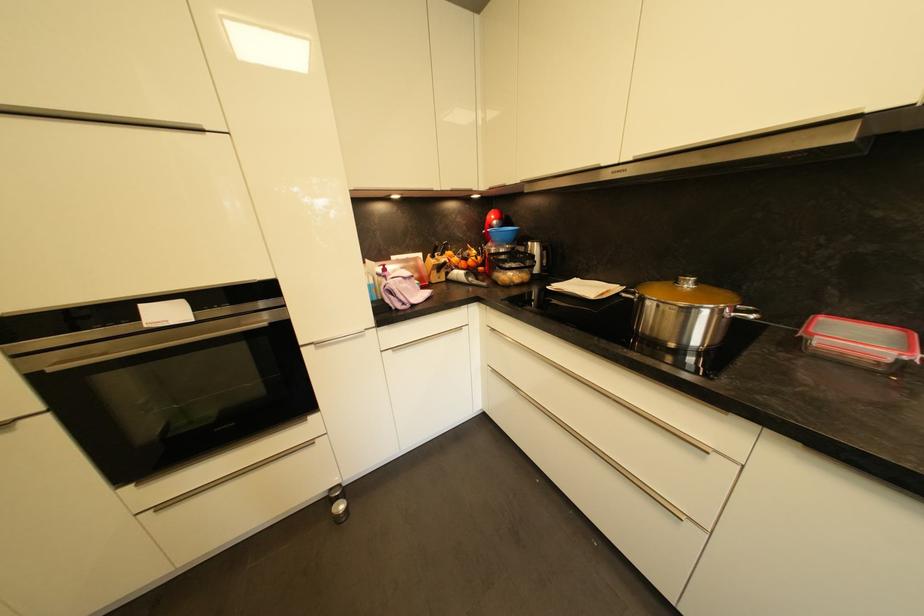
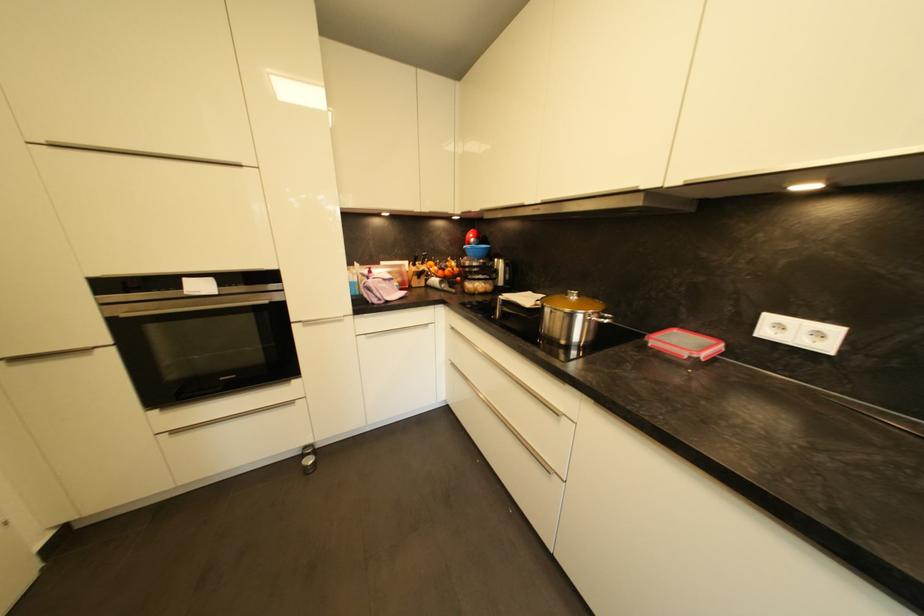
Question: The images are taken continuously from a first-person perspective. In which direction is your viewpoint rotating?

Choices:
 (A) Left
 (B) Right
 (C) Up
 (D) Down

Answer: (C)